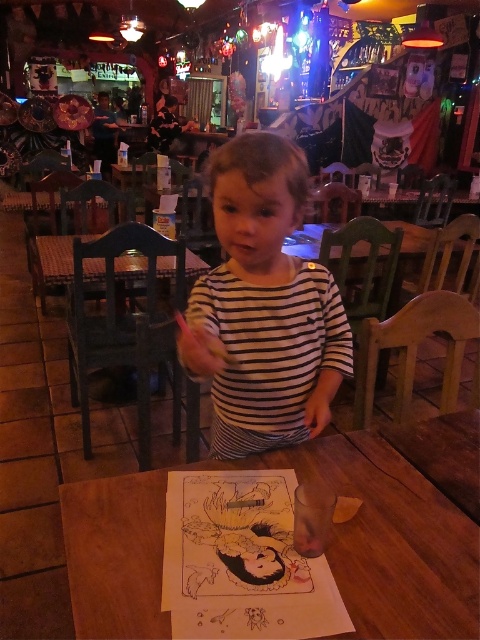
You are a delivery person carrying a box that is 24 inches wide. You need to place it on the wooden table at center. Can you fit the box on the table without it overhanging the edge?

The wooden table at center and camera are 26.07 inches apart. Since the box is 24 inches wide, which is less than the distance between the table and the camera, the box can be placed on the table without overhanging the edge.

You are a customer entering the restaurant and want to sit near the wooden table at center. Where should you look to find the white striped shirt at center?

The wooden table at center is located below the white striped shirt at center, so the white striped shirt at center is above the wooden table at center.

You are standing at the entrance of the restaurant and want to find the wooden table at center. According to the coordinates provided, in which direction should you walk to reach it?

The wooden table at center is located at coordinates point (396, 525). Since the coordinate system typically places (0, 0) at the bottom left corner, moving towards higher x and y values would mean moving to the right and upwards respectively. Therefore, you should walk towards the right and upwards from the entrance to reach the wooden table at center.